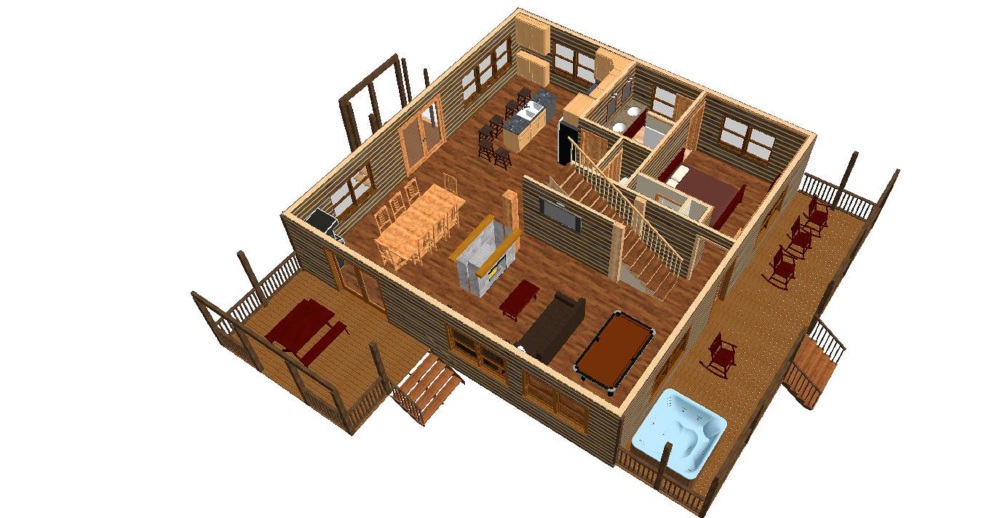
Find the location of a particular element. The width and height of the screenshot is (1000, 518). fireplaces is located at coordinates (483, 280), (462, 272).